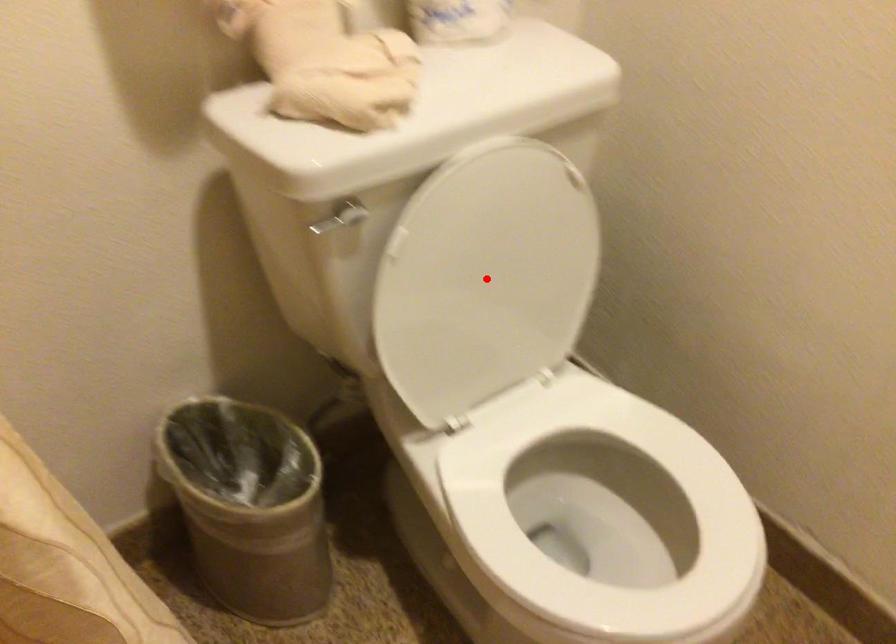
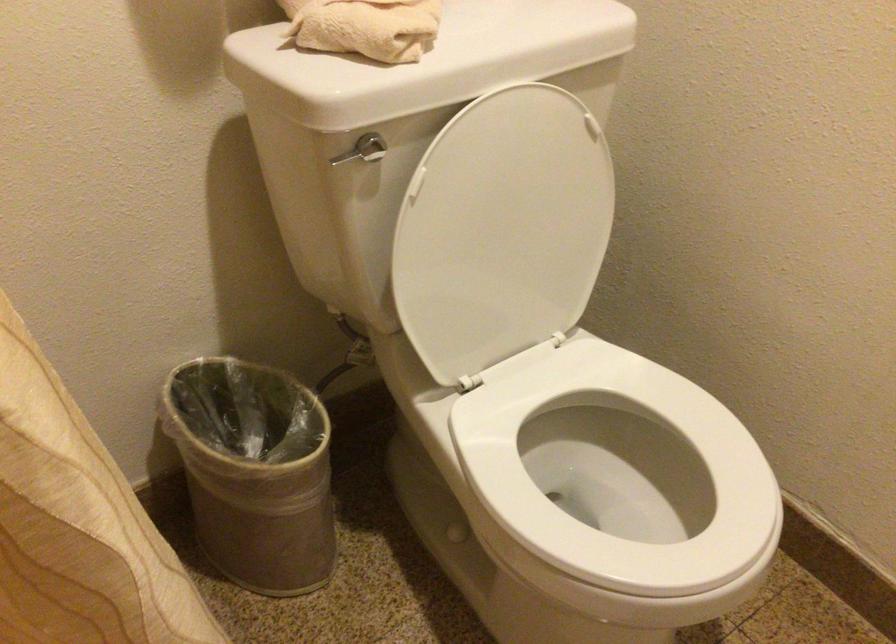
Where in the second image is the point corresponding to the highlighted location from the first image?

(502, 230)